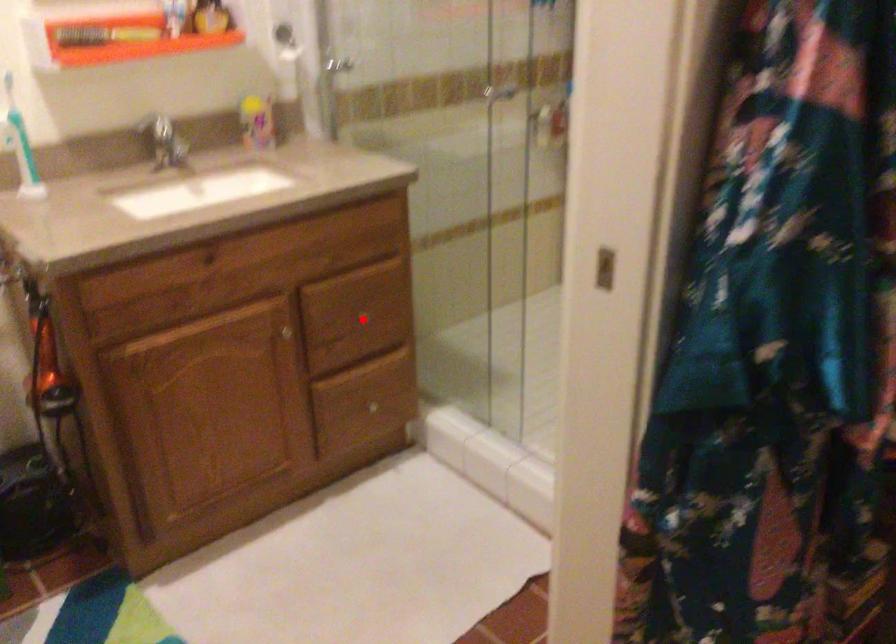
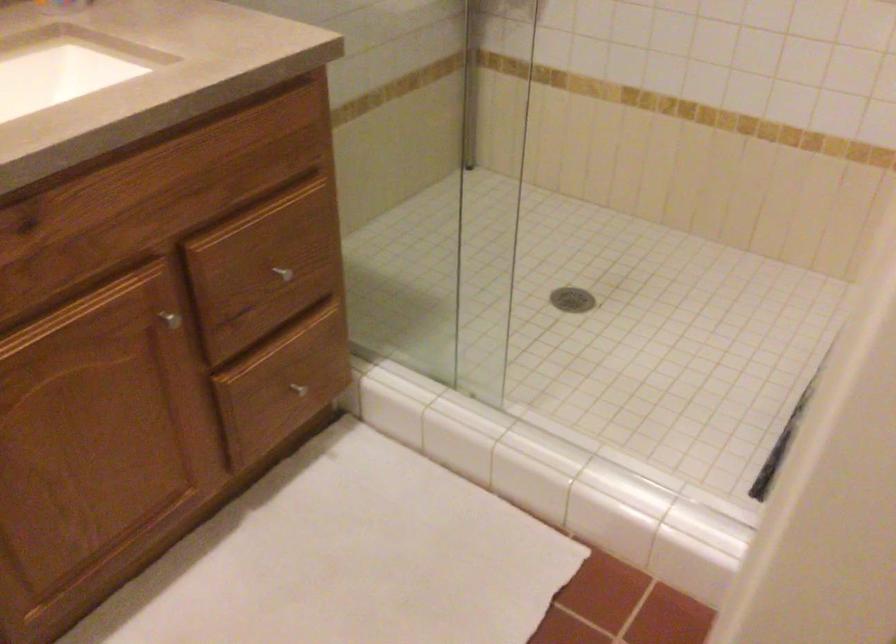
The point at the highlighted location is marked in the first image. Where is the corresponding point in the second image?

(281, 272)